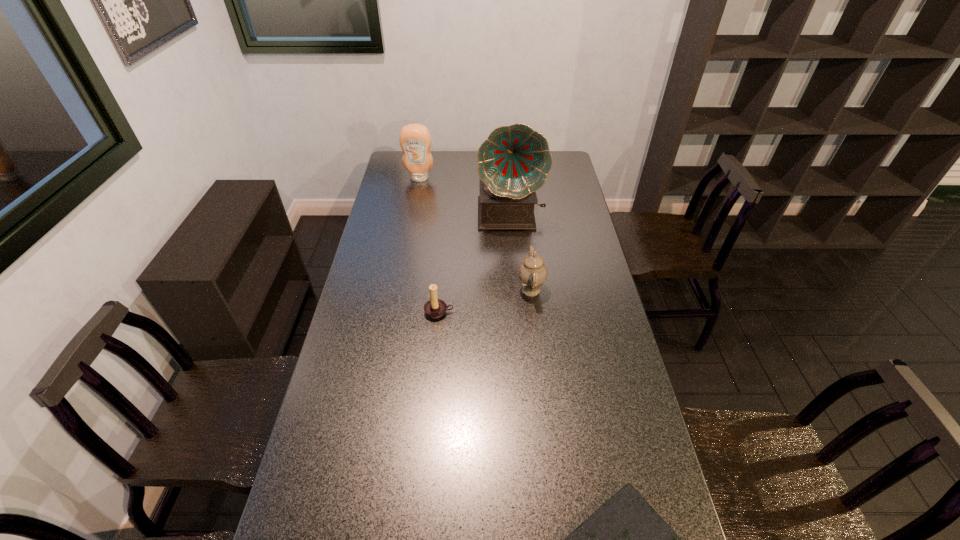
The image size is (960, 540). What are the coordinates of `vacant space that is in between the second shortest object and the chinaware` in the screenshot? It's located at (x=485, y=301).

This screenshot has height=540, width=960. Identify the location of vacant space that is in between the record player and the third tallest object. (520, 252).

At what (x,y) coordinates should I click in order to perform the action: click on vacant area between the chinaware and the candle holder. Please return your answer as a coordinate pair (x, y). The width and height of the screenshot is (960, 540). Looking at the image, I should click on (485, 301).

I want to click on free space between the farthest object and the candle holder, so click(429, 245).

The width and height of the screenshot is (960, 540). Identify the location of object that can be found as the second closest to the third shortest object. (434, 308).

Where is `object that stands as the fourth closest to the shortest object`? The width and height of the screenshot is (960, 540). object that stands as the fourth closest to the shortest object is located at coordinates 415,140.